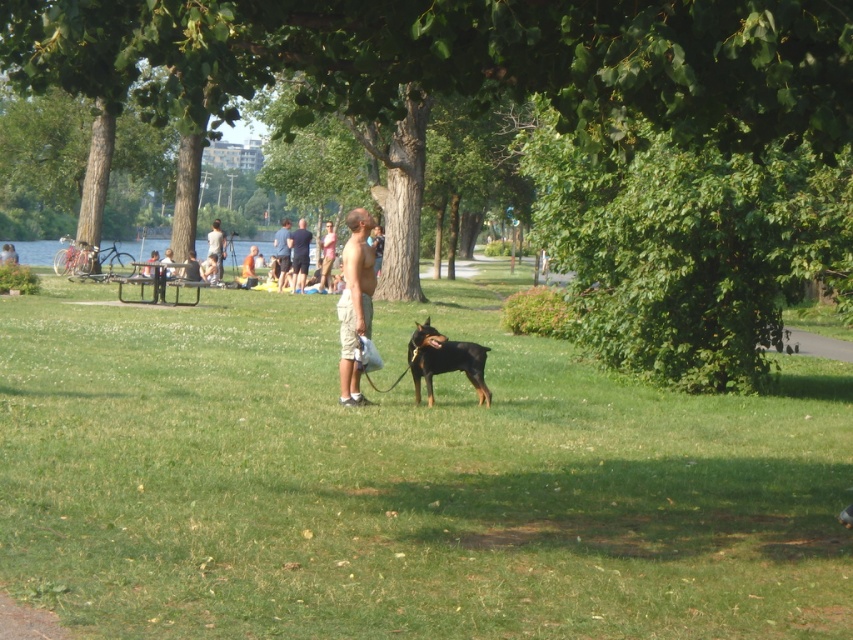
You are planning to set up a small tent in the park. The tent requires a flat area larger than the smooth tan shorts at center. Can the green grass at center accommodate the tent?

The green grass at center has a larger size compared to smooth tan shorts at center, so yes, the green grass at center can accommodate the tent as it is bigger than the required area.

You are standing at the picnic table in the midground of the park scene. You want to walk directly towards the green grass at center. What direction should you face to walk straight towards it?

To walk directly towards the green grass at center, you should face the direction corresponding to the coordinates point specified in the scene description, which is at point (402, 483). However, without a map or compass, the exact direction cannot be determined numerically. In the context of the image, the green grass at center is located centrally in the scene, so facing towards the center area would align you with it.

You are a photographer capturing the scene from a distance. You notice the smooth skin man at center and the smooth tan shorts at center. Which object is positioned closer to you?

The smooth skin man at center is closer to the viewer than the smooth tan shorts at center.